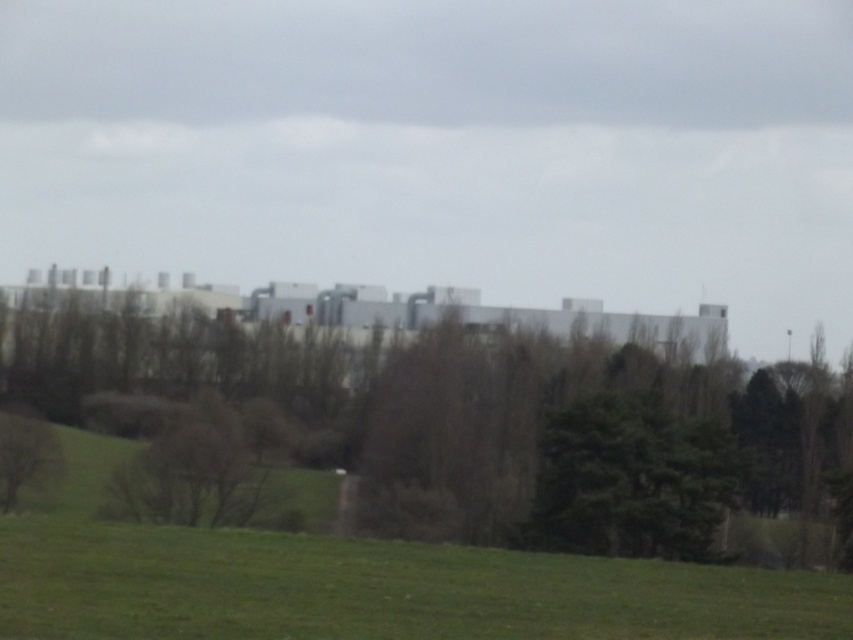
Between green leafy tree at center and green leafy tree at lower left, which one appears on the left side from the viewer's perspective?

Positioned to the left is green leafy tree at lower left.

How much distance is there between green leafy tree at center and green leafy tree at lower left?

They are 23.66 meters apart.

Who is more distant from viewer, (624, 436) or (13, 451)?

Positioned behind is point (624, 436).

This screenshot has width=853, height=640. I want to click on green leafy tree at center, so click(483, 419).